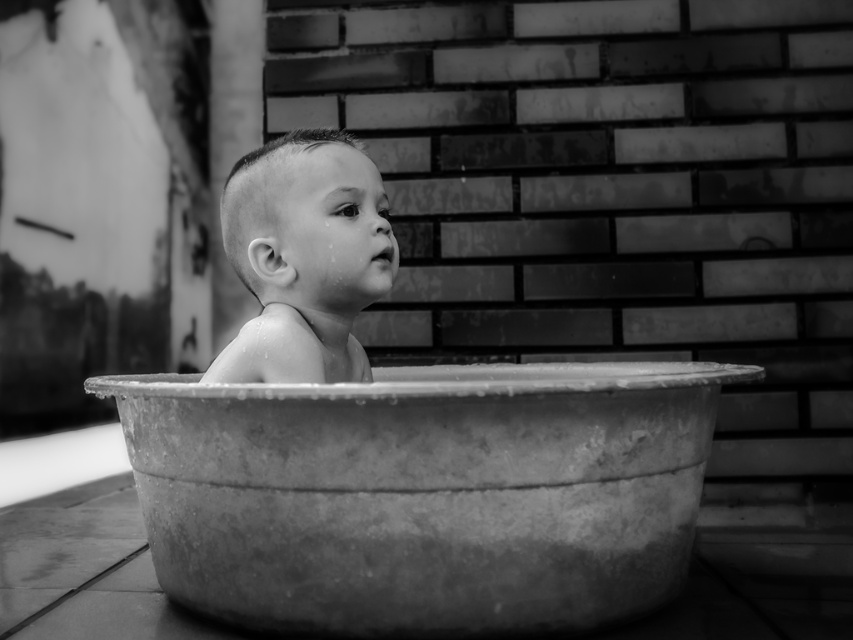
Is metallic tub at center to the left of smooth skin baby at center from the viewer's perspective?

In fact, metallic tub at center is to the right of smooth skin baby at center.

Is metallic tub at center positioned in front of smooth skin baby at center?

That is True.

Describe the element at coordinates (424, 493) in the screenshot. I see `metallic tub at center` at that location.

The image size is (853, 640). Identify the location of metallic tub at center. (424, 493).